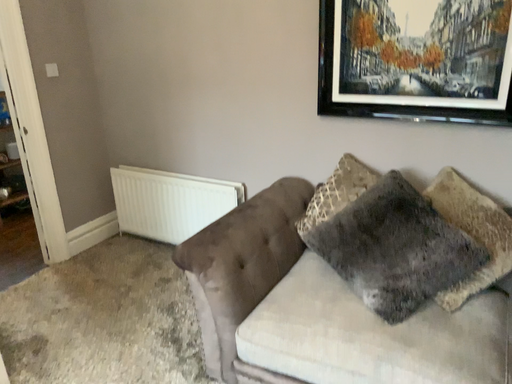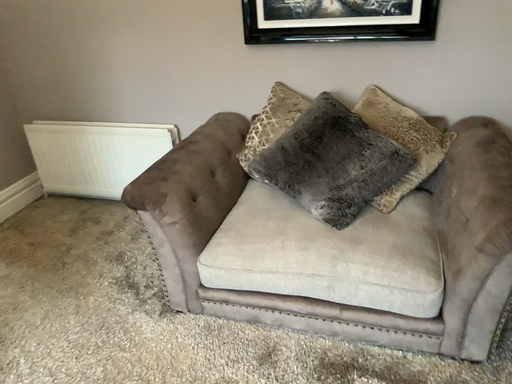
Question: How did the camera likely rotate when shooting the video?

Choices:
 (A) rotated left
 (B) rotated right

Answer: (B)